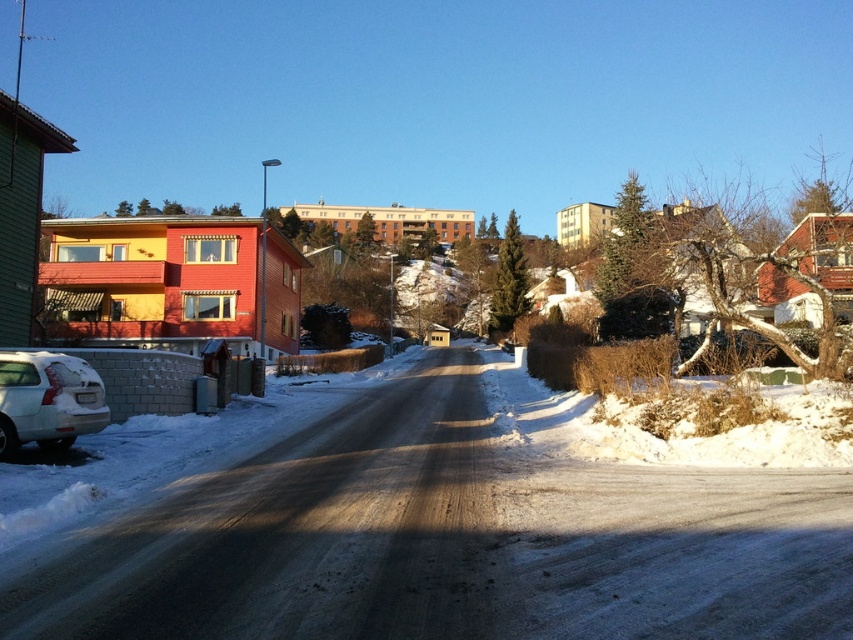
Does point (648, 612) lie behind point (38, 396)?

No.

What do you see at coordinates (450, 540) in the screenshot?
I see `white powdery snow at center` at bounding box center [450, 540].

This screenshot has height=640, width=853. Identify the location of white powdery snow at center. (450, 540).